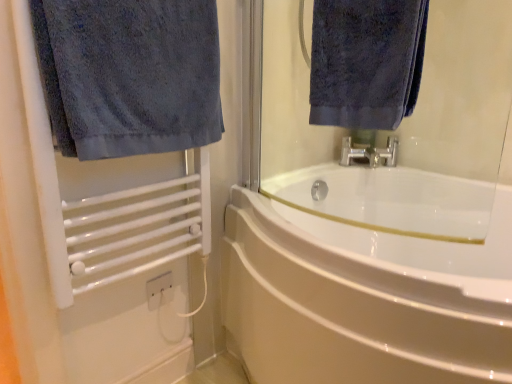
Question: Is dark blue terry cloth towel at upper center, the second towel when ordered from left to right, not near white glossy bathtub at center?

Choices:
 (A) no
 (B) yes

Answer: (A)

Question: Is dark blue terry cloth towel at upper center, the second towel when ordered from left to right, positioned before white glossy bathtub at center?

Choices:
 (A) no
 (B) yes

Answer: (A)

Question: Could you tell me if dark blue terry cloth towel at upper center, the second towel when ordered from left to right, is facing white glossy bathtub at center?

Choices:
 (A) no
 (B) yes

Answer: (A)

Question: From a real-world perspective, is dark blue terry cloth towel at upper center, the second towel when ordered from left to right, physically below white glossy bathtub at center?

Choices:
 (A) no
 (B) yes

Answer: (A)

Question: Does dark blue terry cloth towel at upper center, the second towel when ordered from left to right, lie behind white glossy bathtub at center?

Choices:
 (A) yes
 (B) no

Answer: (A)

Question: From a real-world perspective, is dark blue terry cloth towel at upper center, the second towel when ordered from left to right, on white glossy bathtub at center?

Choices:
 (A) yes
 (B) no

Answer: (A)

Question: Is white glossy bathtub at center thinner than white matte towel rack at left?

Choices:
 (A) yes
 (B) no

Answer: (B)

Question: Considering the relative sizes of white glossy bathtub at center and white matte towel rack at left in the image provided, is white glossy bathtub at center bigger than white matte towel rack at left?

Choices:
 (A) yes
 (B) no

Answer: (A)

Question: Is white glossy bathtub at center in contact with white matte towel rack at left?

Choices:
 (A) yes
 (B) no

Answer: (B)

Question: Is white glossy bathtub at center oriented towards white matte towel rack at left?

Choices:
 (A) yes
 (B) no

Answer: (B)

Question: Is white glossy bathtub at center not near white matte towel rack at left?

Choices:
 (A) no
 (B) yes

Answer: (A)

Question: Can you confirm if white glossy bathtub at center is shorter than white matte towel rack at left?

Choices:
 (A) yes
 (B) no

Answer: (A)

Question: Is dark blue terry cloth towel at left, which is counted as the second towel, starting from the right, shorter than white matte towel rack at left?

Choices:
 (A) yes
 (B) no

Answer: (A)